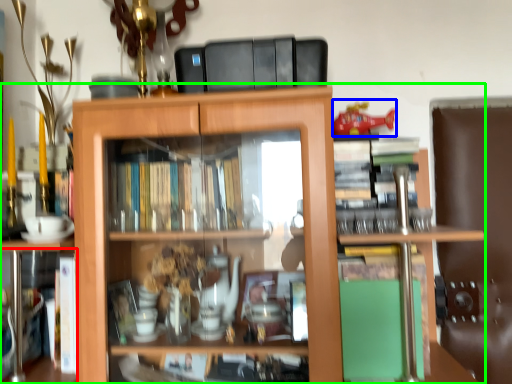
Question: Which object is positioned closest to book (highlighted by a red box)? Select from toy (highlighted by a blue box) and shelf (highlighted by a green box).

Choices:
 (A) toy
 (B) shelf

Answer: (B)